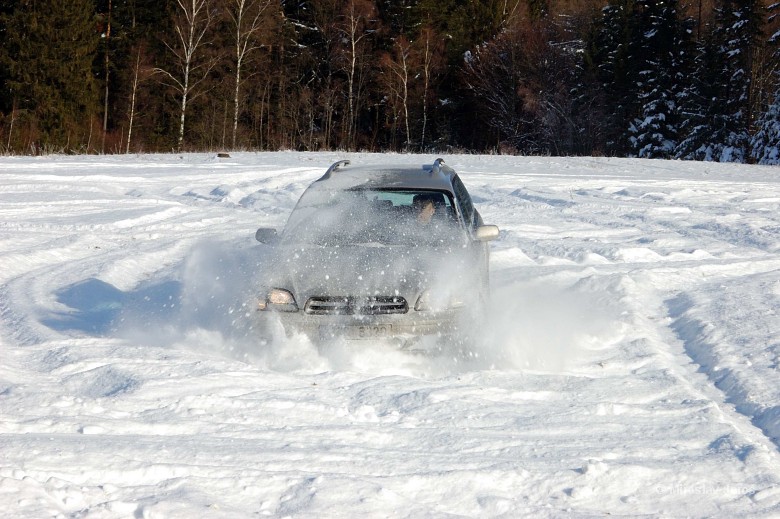
The width and height of the screenshot is (780, 519). Find the location of `side windows`. side windows is located at coordinates (463, 200).